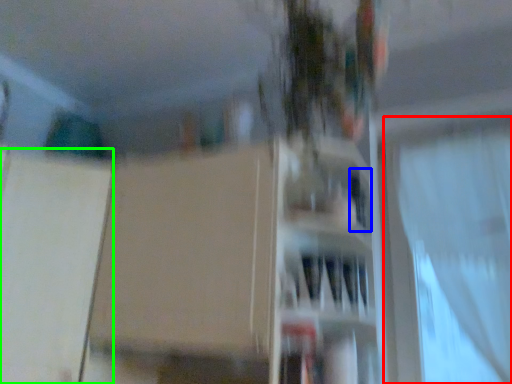
Question: Based on their relative distances, which object is nearer to curtain (highlighted by a red box)? Choose from window (highlighted by a blue box) and screen door (highlighted by a green box).

Choices:
 (A) window
 (B) screen door

Answer: (A)